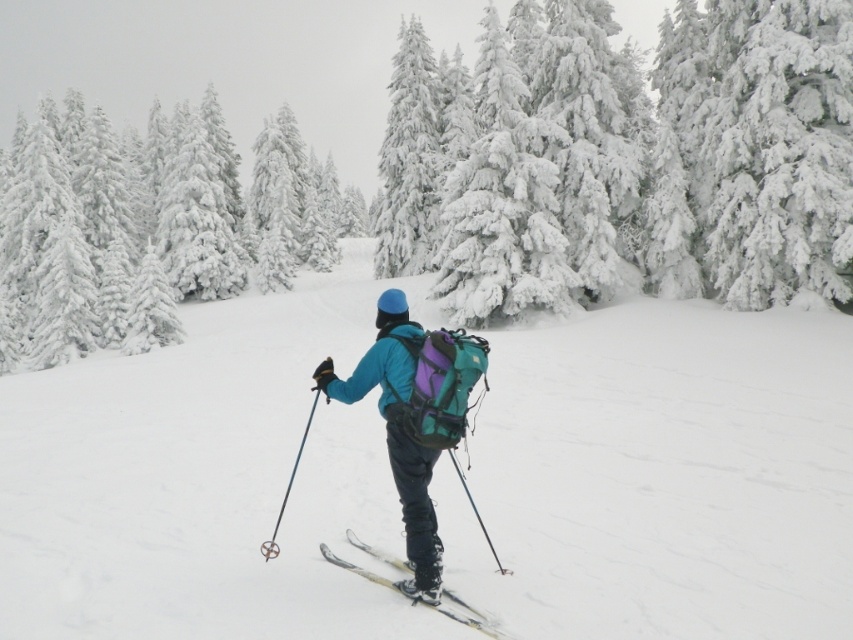
Between white snow-covered tree at upper center and yellow metallic skis at center, which one appears on the right side from the viewer's perspective?

white snow-covered tree at upper center

From the picture: Who is taller, white snow-covered tree at upper center or yellow metallic skis at center?

white snow-covered tree at upper center

Does point (746, 300) come in front of point (473, 612)?

No, (746, 300) is further to viewer.

Identify the location of white snow-covered tree at upper center. The image size is (853, 640). (753, 150).

Which is behind, point (408, 390) or point (328, 556)?

The point (328, 556) is behind.

Does point (344, 381) lie behind point (440, 592)?

That is True.

Between point (418, 540) and point (430, 605), which one is positioned behind?

Positioned behind is point (418, 540).

Where is `teal matte backpack at center`? teal matte backpack at center is located at coordinates (415, 417).

How far apart are white snow-covered trees at upper left and yellow metallic skis at center?

white snow-covered trees at upper left is 71.21 meters away from yellow metallic skis at center.

Between white snow-covered trees at upper left and yellow metallic skis at center, which one is positioned lower?

yellow metallic skis at center

Who is more distant from viewer, (x=210, y=234) or (x=492, y=632)?

The point (x=210, y=234) is behind.

At what (x,y) coordinates should I click in order to perform the action: click on white snow-covered trees at upper left. Please return your answer as a coordinate pair (x, y). The image size is (853, 640). Looking at the image, I should click on (161, 228).